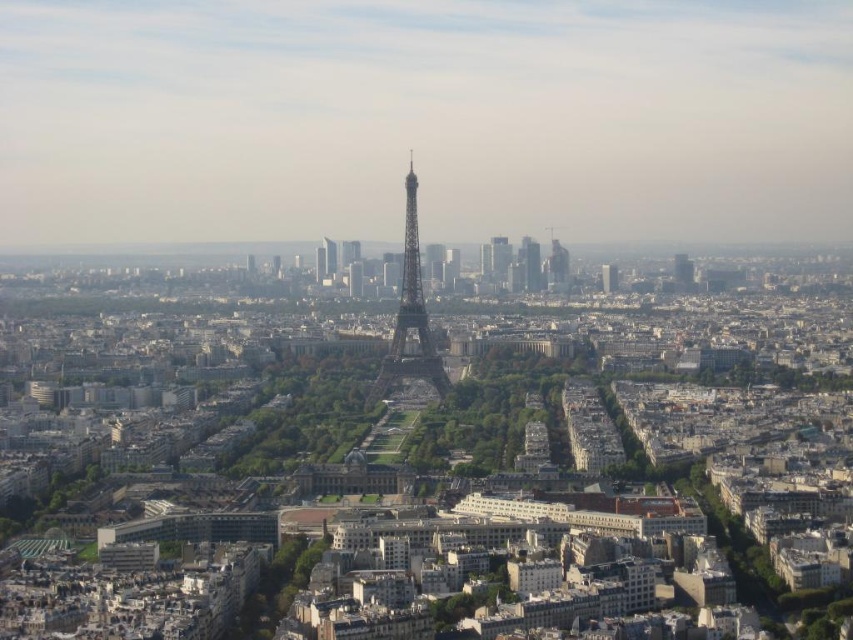
Can you confirm if glassy reflective skyscraper at center is positioned below shiny silver tower at center?

Yes, glassy reflective skyscraper at center is below shiny silver tower at center.

Is point (503, 276) closer to viewer compared to point (328, 260)?

No, it is not.

Is point (508, 252) in front of point (328, 275)?

Yes, point (508, 252) is closer to viewer.

Where is `glassy reflective skyscraper at center`? The height and width of the screenshot is (640, 853). glassy reflective skyscraper at center is located at coordinates (498, 257).

Does metallic silver eiffel tower at center have a greater height compared to shiny silver tower at center?

Yes.

Is metallic silver eiffel tower at center shorter than shiny silver tower at center?

Incorrect, metallic silver eiffel tower at center's height does not fall short of shiny silver tower at center's.

What are the coordinates of `metallic silver eiffel tower at center` in the screenshot? It's located at (410, 317).

At what (x,y) coordinates should I click in order to perform the action: click on metallic silver eiffel tower at center. Please return your answer as a coordinate pair (x, y). This screenshot has height=640, width=853. Looking at the image, I should click on (410, 317).

Which is above, metallic silver eiffel tower at center or glassy reflective skyscraper at center?

Positioned higher is glassy reflective skyscraper at center.

Looking at this image, who is positioned more to the right, metallic silver eiffel tower at center or glassy reflective skyscraper at center?

Positioned to the right is glassy reflective skyscraper at center.

What do you see at coordinates (410, 317) in the screenshot?
I see `metallic silver eiffel tower at center` at bounding box center [410, 317].

Locate an element on the screen. The image size is (853, 640). metallic silver eiffel tower at center is located at coordinates (410, 317).